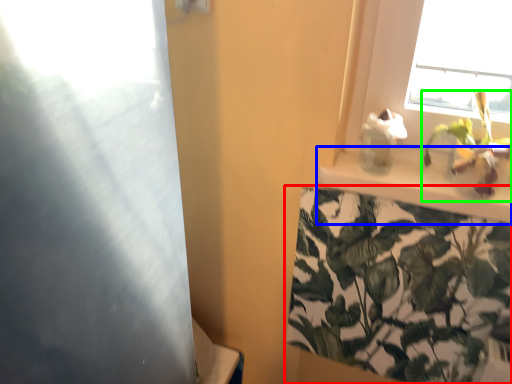
Question: Which object is positioned closest to houseplant (highlighted by a red box)? Select from window sill (highlighted by a blue box) and houseplant (highlighted by a green box).

Choices:
 (A) window sill
 (B) houseplant

Answer: (A)